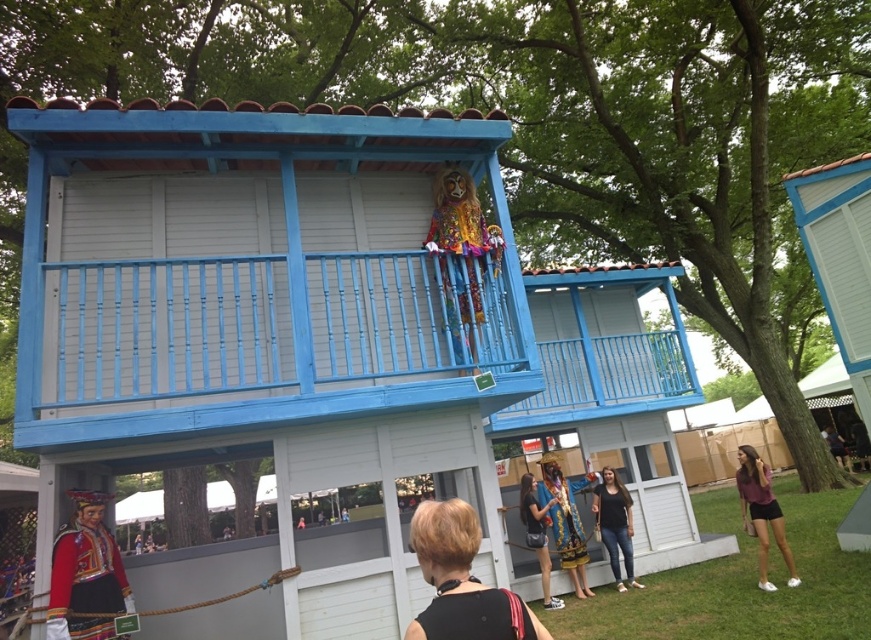
You are a photographer trying to capture a photo of the gold metallic statue at center and the matte black dress at center. Since both are at the center, how can you position them in your frame to ensure they are both visible?

The gold metallic statue at center is to the right of the matte black dress at center, so position the matte black dress at center on the left side of your frame and the gold metallic statue at center on the right side to include both in the photo.

You are an event planner arranging a photo shoot for the cultural event. You need to place a large camera tripod between the red velvet costume at lower left and the matte burgundy blouse at lower right. Can the tripod be placed there without overlapping either costume?

The red velvet costume at lower left is positioned over the matte burgundy blouse at lower right, meaning there is no space between them. Therefore, the tripod cannot be placed between them without overlapping one of the costumes.

You are a photographer trying to capture the scene in front of the blue and white building. You want to ensure both the short hair at center and the jeans at center are clearly visible. Which object should you focus on first to ensure proper focus, considering their sizes?

The short hair at center has a smaller size compared to jeans at center. To ensure proper focus on both, you should focus on the smaller object first, which is the short hair at center, as it requires more precise focusing due to its smaller size.